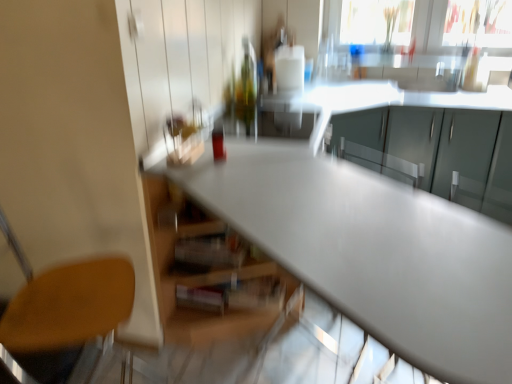
The image size is (512, 384). Find the location of `free region under transparent glass window screen at upper right (from a real-world perspective)`. free region under transparent glass window screen at upper right (from a real-world perspective) is located at coordinates (468, 55).